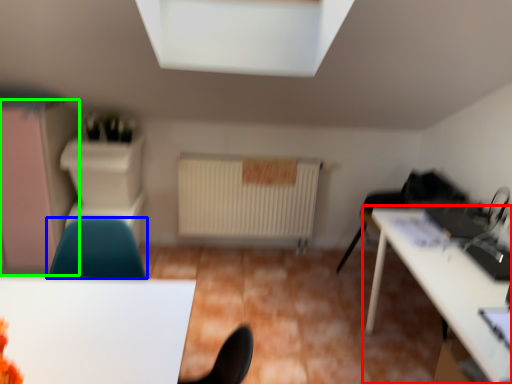
Question: Considering the real-world distances, which object is farthest from table (highlighted by a red box)? chair (highlighted by a blue box) or dresser (highlighted by a green box)?

Choices:
 (A) chair
 (B) dresser

Answer: (B)